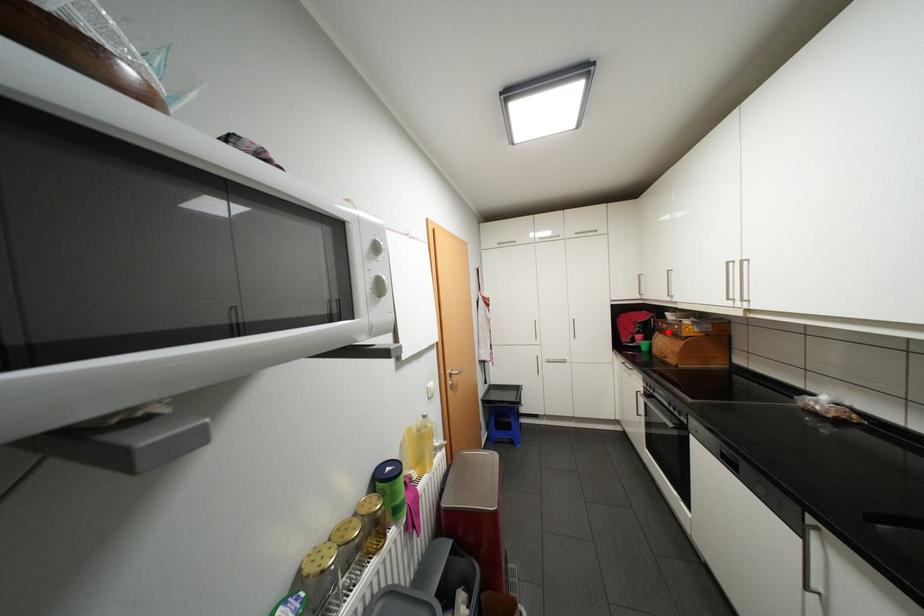
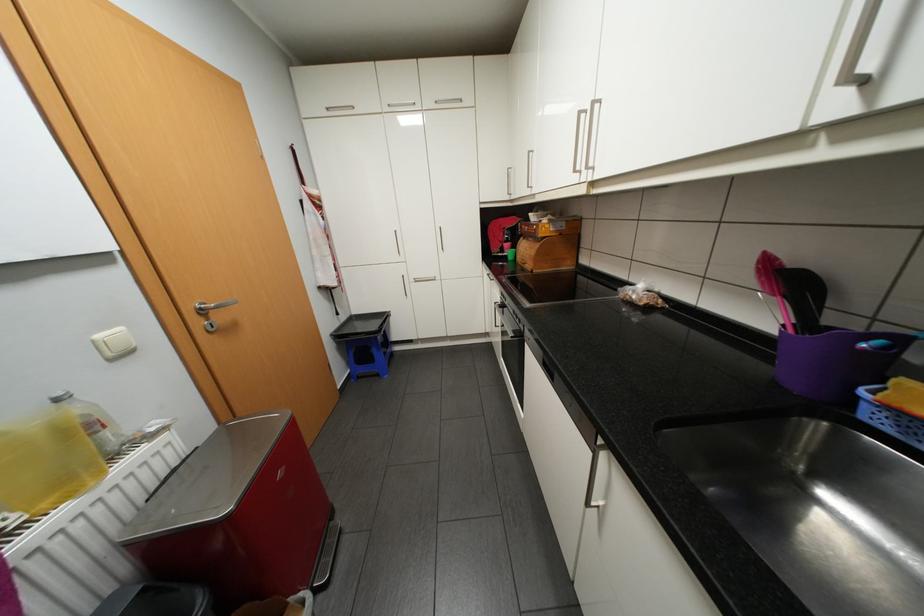
Question: I am providing you with two images of the same scene from different viewpoints. In image1, a red point is highlighted. Considering the same 3D point in image2, which of the following is correct?

Choices:
 (A) It is closer
 (B) It is farther

Answer: (A)